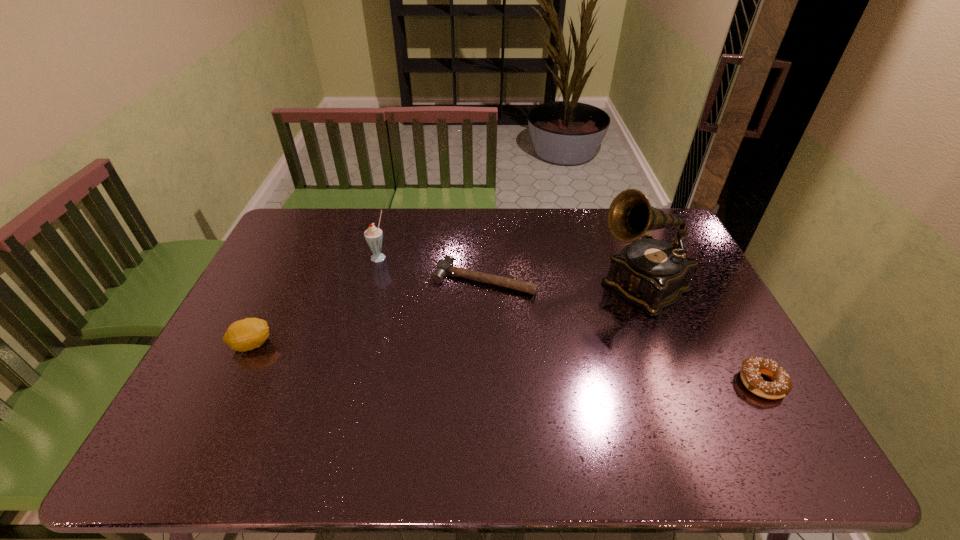
At what (x,y) coordinates should I click in order to perform the action: click on free space on the desktop that is between the leftmost object and the doughnut and is positioned on the straw side of the fourth shortest object. Please return your answer as a coordinate pair (x, y). Looking at the image, I should click on (483, 362).

Where is `free spot on the desktop that is between the third tallest object and the nearest object and is positioned on the horn of the phonograph record`? Image resolution: width=960 pixels, height=540 pixels. free spot on the desktop that is between the third tallest object and the nearest object and is positioned on the horn of the phonograph record is located at coordinates (528, 365).

This screenshot has height=540, width=960. I want to click on vacant space on the desktop that is between the leftmost object and the doughnut and is positioned on the striking face of the hammer, so click(443, 359).